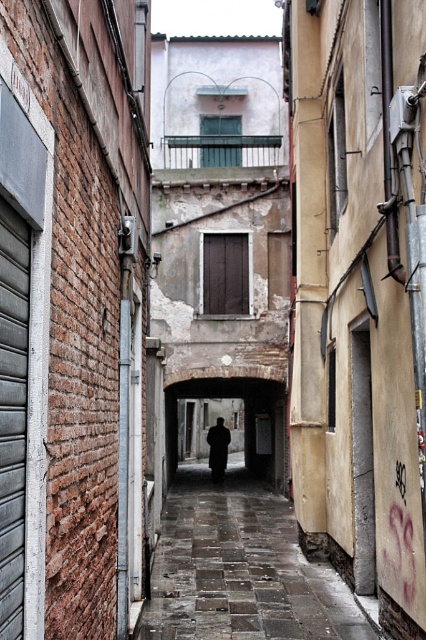
Question: Which point is closer to the camera?

Choices:
 (A) (226, 433)
 (B) (184, 540)

Answer: (B)

Question: Which of the following is the closest to the observer?

Choices:
 (A) (235, 636)
 (B) (227, 432)

Answer: (A)

Question: Considering the relative positions of dark gray stone path at center and dark wool coat at center in the image provided, where is dark gray stone path at center located with respect to dark wool coat at center?

Choices:
 (A) right
 (B) left

Answer: (A)

Question: In this image, where is dark gray stone path at center located relative to dark wool coat at center?

Choices:
 (A) left
 (B) right

Answer: (B)

Question: Which point is farther from the camera taking this photo?

Choices:
 (A) (213, 476)
 (B) (222, 621)

Answer: (A)

Question: Can you confirm if dark gray stone path at center is positioned to the left of dark wool coat at center?

Choices:
 (A) yes
 (B) no

Answer: (B)